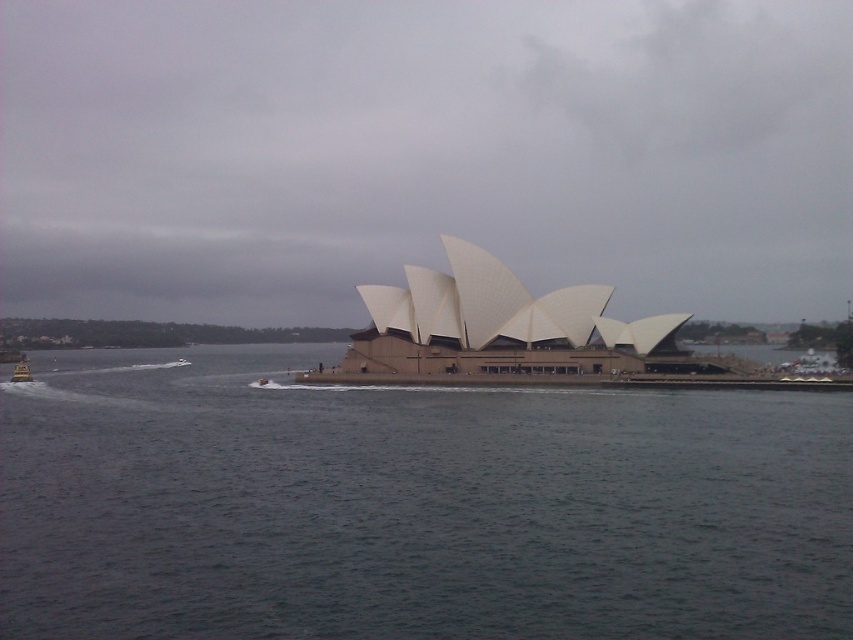
Question: Does white matte sydney opera house at center appear under beige concrete opera house at center?

Choices:
 (A) no
 (B) yes

Answer: (A)

Question: Does white matte sydney opera house at center lie in front of gray water at center?

Choices:
 (A) no
 (B) yes

Answer: (A)

Question: Which object is farther from the camera taking this photo?

Choices:
 (A) gray water at center
 (B) metallic silver boat at lower left
 (C) beige concrete opera house at center
 (D) white matte sydney opera house at center

Answer: (B)

Question: Which of the following is the farthest from the observer?

Choices:
 (A) (606, 321)
 (B) (683, 202)
 (C) (15, 368)
 (D) (682, 531)

Answer: (B)

Question: Considering the relative positions of gray water at center and metallic silver boat at lower left in the image provided, where is gray water at center located with respect to metallic silver boat at lower left?

Choices:
 (A) below
 (B) above

Answer: (B)

Question: Which object appears closest to the camera in this image?

Choices:
 (A) white matte sydney opera house at center
 (B) metallic silver boat at lower left
 (C) beige concrete opera house at center
 (D) gray water at center

Answer: (D)